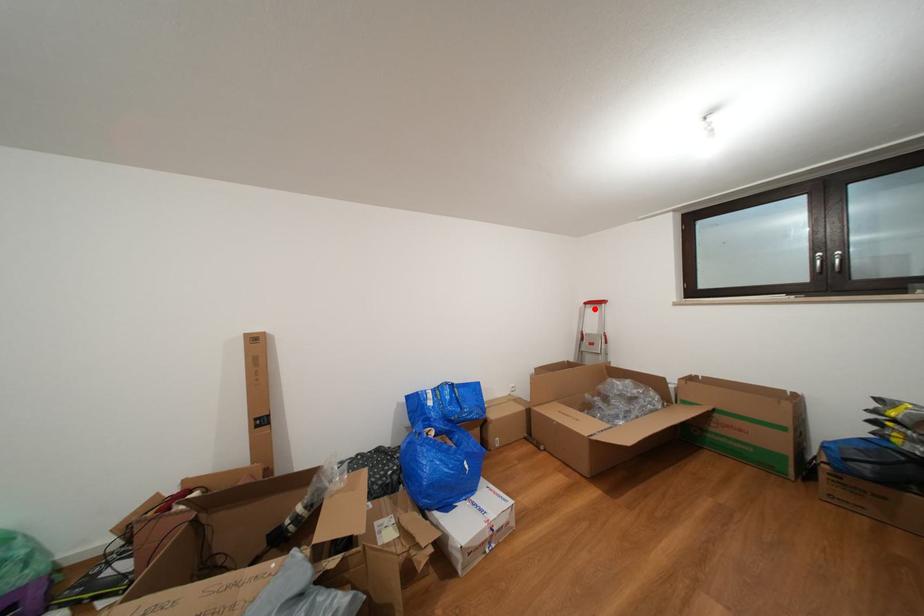
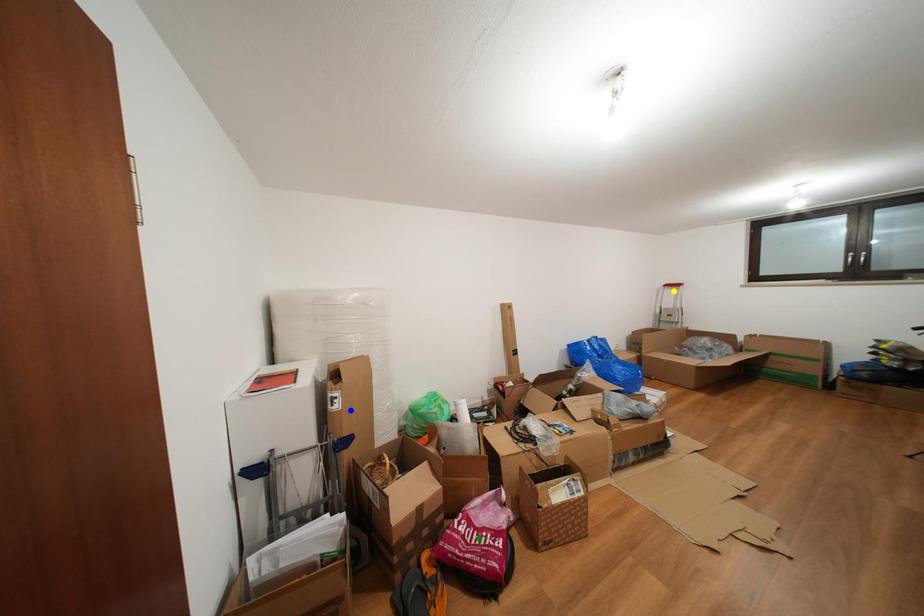
Question: I am providing you with two images of the same scene from different viewpoints. A red point is marked on the first image. You are given multiple points on the second image. Which mark in image 2 goes with the point in image 1?

Choices:
 (A) green point
 (B) blue point
 (C) yellow point

Answer: (C)